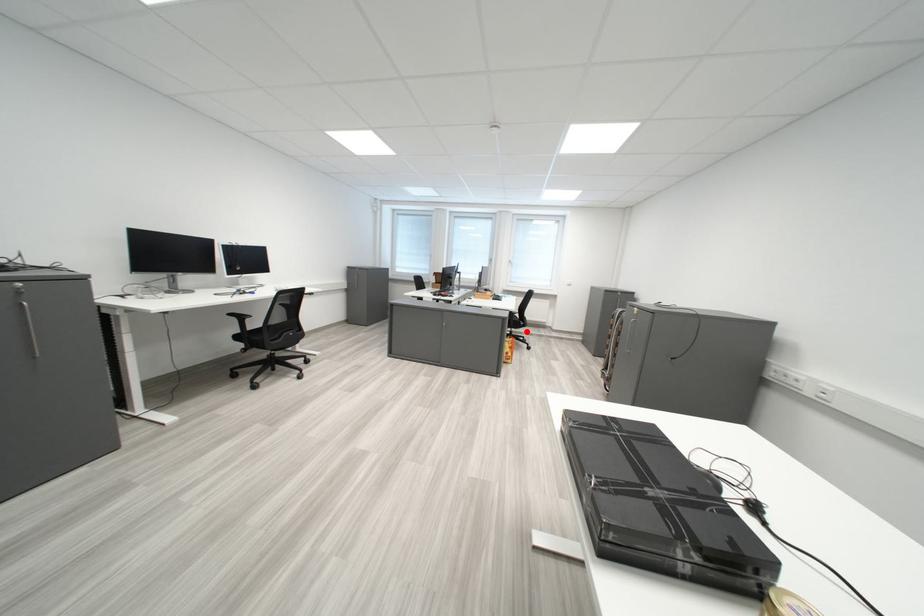
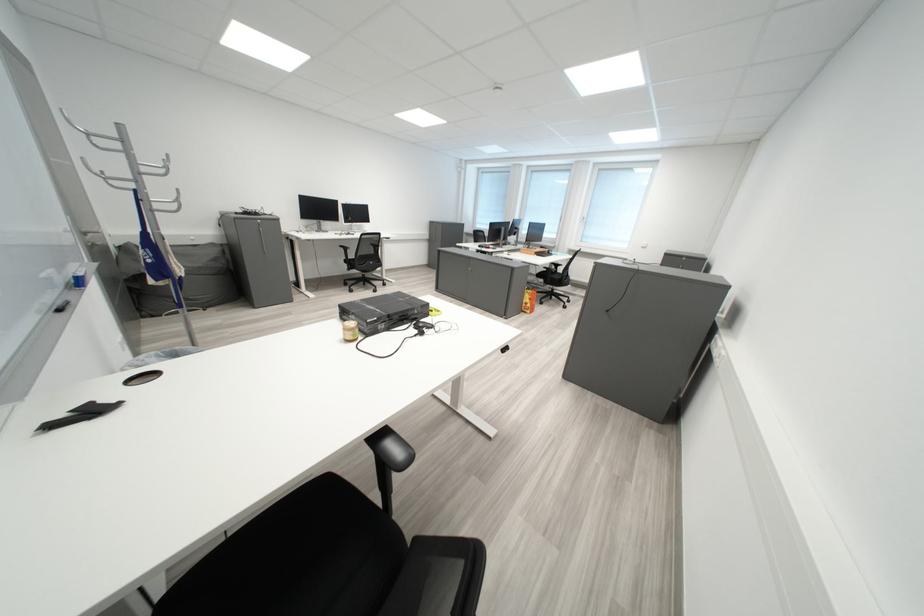
Question: I am providing you with two images of the same scene from different viewpoints. In image1, a red point is highlighted. Considering the same 3D point in image2, which of the following is correct?

Choices:
 (A) It is closer
 (B) It is farther

Answer: (A)